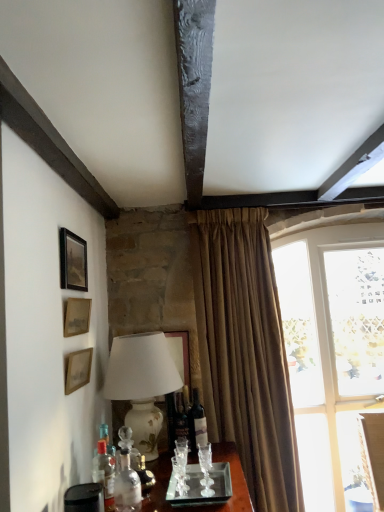
Question: From a real-world perspective, is clear glass window at right located higher than wooden picture frame at left, the third picture frame from the top?

Choices:
 (A) no
 (B) yes

Answer: (A)

Question: Is clear glass window at right in contact with wooden picture frame at left, the third picture frame from the top?

Choices:
 (A) yes
 (B) no

Answer: (B)

Question: Considering the relative sizes of clear glass window at right and wooden picture frame at left, arranged as the 1th picture frame when ordered from the bottom, in the image provided, is clear glass window at right smaller than wooden picture frame at left, arranged as the 1th picture frame when ordered from the bottom,?

Choices:
 (A) yes
 (B) no

Answer: (B)

Question: Could you tell me if clear glass window at right is turned towards wooden picture frame at left, arranged as the 1th picture frame when ordered from the bottom?

Choices:
 (A) no
 (B) yes

Answer: (A)

Question: From the image's perspective, is clear glass window at right under wooden picture frame at left, arranged as the 1th picture frame when ordered from the bottom?

Choices:
 (A) no
 (B) yes

Answer: (B)

Question: From a real-world perspective, is matte glass wine bottle at center physically located above or below wooden picture frame at left, the third picture frame from the top?

Choices:
 (A) above
 (B) below

Answer: (B)

Question: Is matte glass wine bottle at center situated inside wooden picture frame at left, the third picture frame from the top, or outside?

Choices:
 (A) outside
 (B) inside

Answer: (A)

Question: Is matte glass wine bottle at center bigger or smaller than wooden picture frame at left, arranged as the 1th picture frame when ordered from the bottom?

Choices:
 (A) big
 (B) small

Answer: (A)

Question: Is matte glass wine bottle at center taller or shorter than wooden picture frame at left, arranged as the 1th picture frame when ordered from the bottom?

Choices:
 (A) short
 (B) tall

Answer: (B)

Question: Is white ceramic lamp at left in front of or behind wooden picture frame at left, arranged as the 1th picture frame when ordered from the bottom, in the image?

Choices:
 (A) behind
 (B) front

Answer: (A)

Question: Considering the positions of point (114, 384) and point (74, 390), is point (114, 384) closer or farther from the camera than point (74, 390)?

Choices:
 (A) closer
 (B) farther

Answer: (B)

Question: Looking at the image, does white ceramic lamp at left seem bigger or smaller compared to wooden picture frame at left, the third picture frame from the top?

Choices:
 (A) small
 (B) big

Answer: (B)

Question: Considering the positions of white ceramic lamp at left and wooden picture frame at left, arranged as the 1th picture frame when ordered from the bottom, in the image, is white ceramic lamp at left wider or thinner than wooden picture frame at left, arranged as the 1th picture frame when ordered from the bottom,?

Choices:
 (A) wide
 (B) thin

Answer: (A)

Question: Is point (175, 396) closer or farther from the camera than point (69, 301)?

Choices:
 (A) farther
 (B) closer

Answer: (A)

Question: From the image's perspective, is translucent glass wine bottle at center, the 3th bottle from the left, above or below matte gold picture frame at upper left, placed as the second picture frame when sorted from bottom to top?

Choices:
 (A) below
 (B) above

Answer: (A)